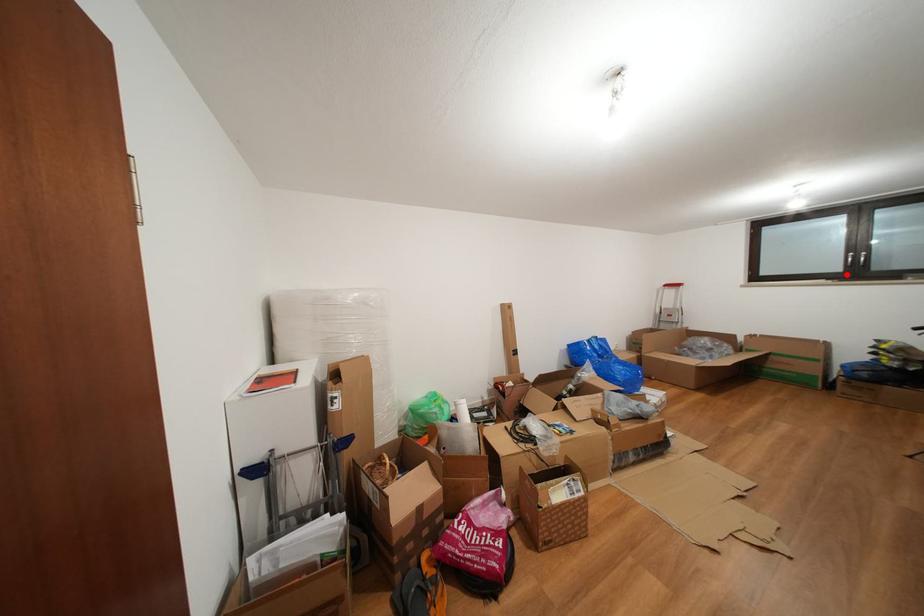
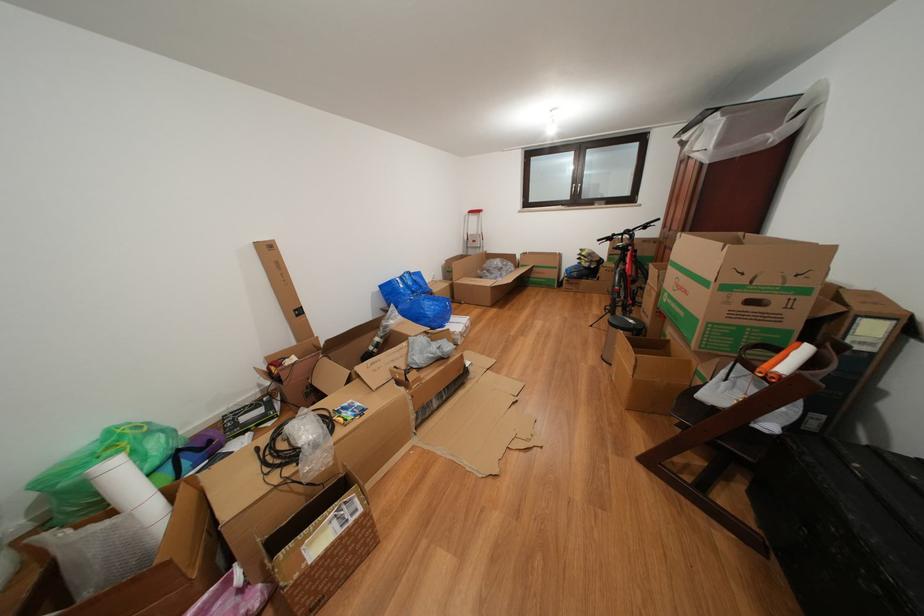
Locate, in the second image, the point that corresponds to the highlighted location in the first image.

(576, 203)